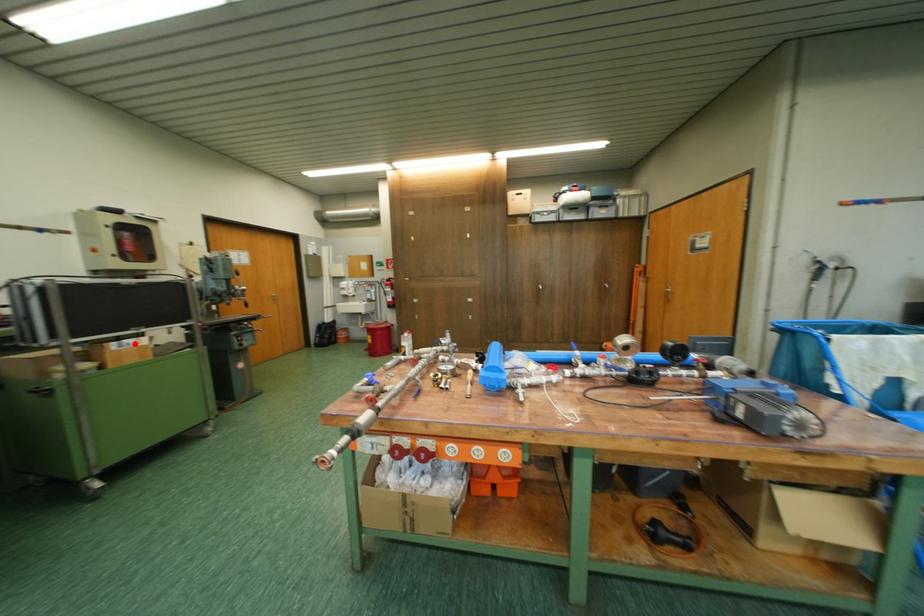
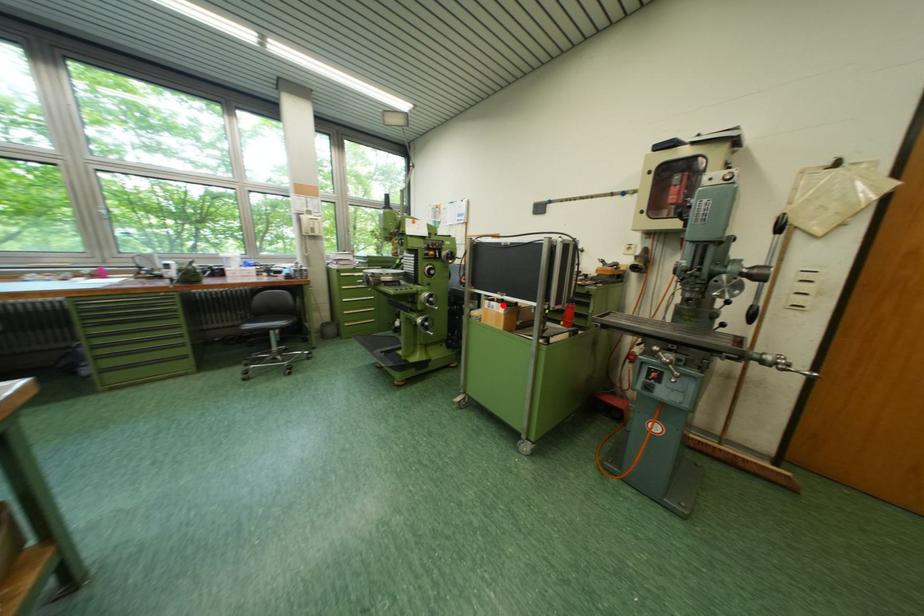
I am providing you with two images of the same scene from different viewpoints. A red point is marked on the first image and another point is marked on the second image. Do the highlighted points in image1 and image2 indicate the same real-world spot?

Yes